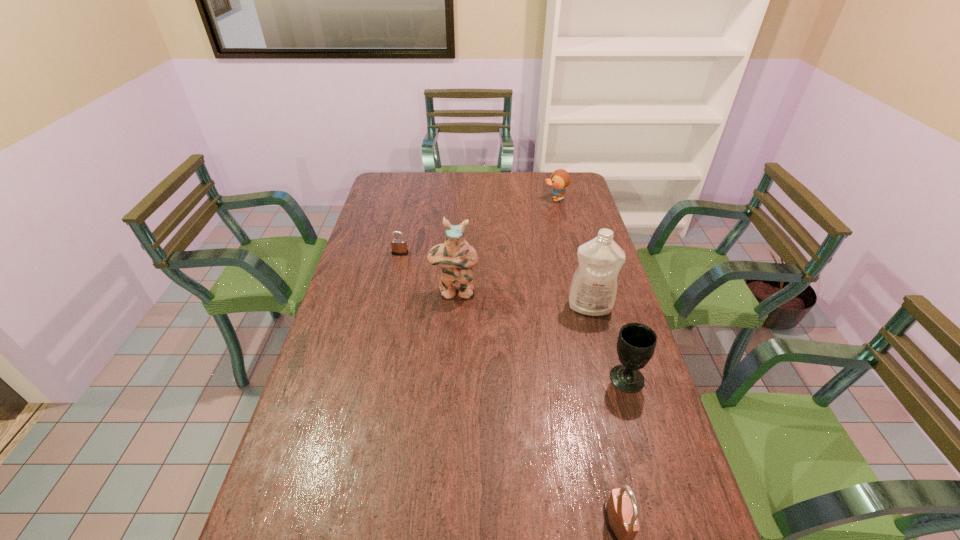
Where is `vacant region at the near edge`? This screenshot has width=960, height=540. vacant region at the near edge is located at coordinates (600, 521).

Locate an element on the screen. The image size is (960, 540). free region at the left edge of the desktop is located at coordinates (392, 228).

Find the location of `free region at the right edge`. free region at the right edge is located at coordinates (582, 221).

This screenshot has height=540, width=960. Find the location of `blank region between the chalice and the fifth object from right to left`. blank region between the chalice and the fifth object from right to left is located at coordinates (540, 335).

You are a GUI agent. You are given a task and a screenshot of the screen. Output one action in this format:
    pyautogui.click(x=<x>, y=<y>)
    Task: Click on the empty space that is in between the detergent and the farthest object
    
    Given the screenshot: What is the action you would take?
    pyautogui.click(x=572, y=253)

Where is `object that stands as the second closest to the taller padlock`? object that stands as the second closest to the taller padlock is located at coordinates (593, 289).

Identify which object is located as the fourth nearest to the shortest object. Please provide its 2D coordinates. Your answer should be formatted as a tuple, i.e. [(x, y)], where the tuple contains the x and y coordinates of a point satisfying the conditions above.

[(636, 343)]

Image resolution: width=960 pixels, height=540 pixels. Find the location of `free space that satisfies the following two spatial constraints: 1. on the front-facing side of the farthest object; 2. on the front-facing side of the figurine`. free space that satisfies the following two spatial constraints: 1. on the front-facing side of the farthest object; 2. on the front-facing side of the figurine is located at coordinates (578, 293).

At what (x,y) coordinates should I click in order to perform the action: click on blank space that satisfies the following two spatial constraints: 1. on the front-facing side of the detergent; 2. on the right side of the duck. Please return your answer as a coordinate pair (x, y). Image resolution: width=960 pixels, height=540 pixels. Looking at the image, I should click on (582, 307).

Where is `vacant point that satisfies the following two spatial constraints: 1. on the front-facing side of the fifth object from right to left; 2. on the right side of the detergent`? This screenshot has width=960, height=540. vacant point that satisfies the following two spatial constraints: 1. on the front-facing side of the fifth object from right to left; 2. on the right side of the detergent is located at coordinates (454, 307).